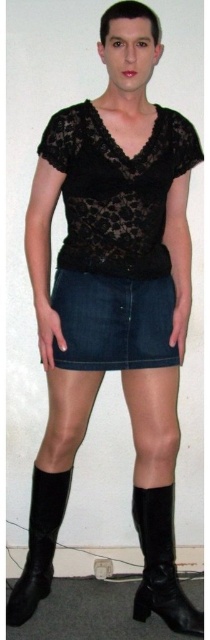
Question: Does black leather boot at lower center have a greater width compared to black leather boot at lower left?

Choices:
 (A) yes
 (B) no

Answer: (A)

Question: Which object appears closest to the camera in this image?

Choices:
 (A) lace fabric top at center
 (B) black leather boot at lower center
 (C) denim skirt at center

Answer: (A)

Question: Does lace fabric top at center have a greater width compared to black leather boot at lower center?

Choices:
 (A) yes
 (B) no

Answer: (A)

Question: Does black leather boot at lower center appear on the left side of black leather boot at lower left?

Choices:
 (A) no
 (B) yes

Answer: (A)

Question: Among these objects, which one is nearest to the camera?

Choices:
 (A) denim skirt at center
 (B) lace fabric top at center

Answer: (B)

Question: Estimate the real-world distances between objects in this image. Which object is closer to the black leather boot at lower left?

Choices:
 (A) lace fabric top at center
 (B) black leather boot at lower center
 (C) denim skirt at center

Answer: (B)